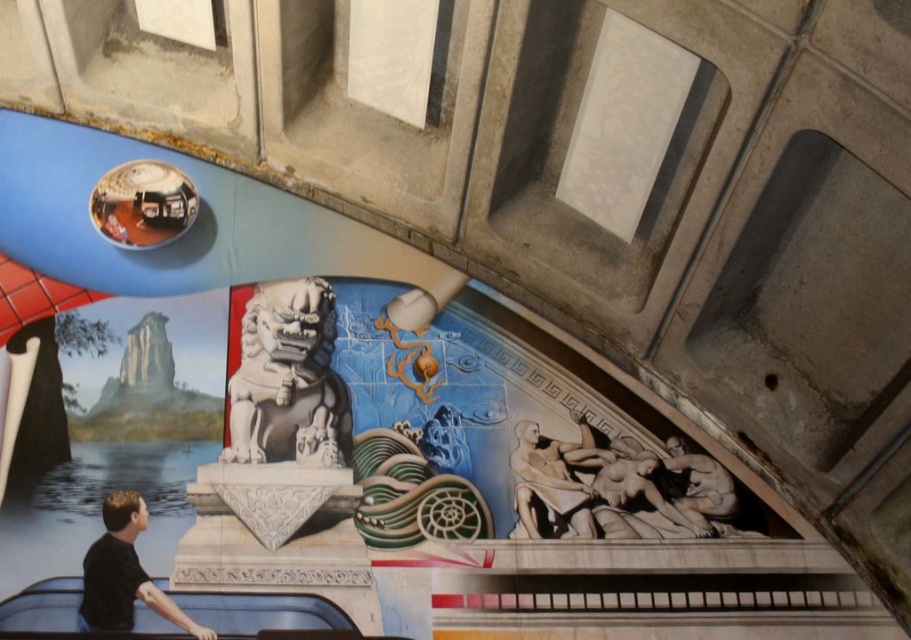
Based on the photo, you are an art student analyzing the mural. You notice two statues at the lower right corner of the mural. Which one is taller between the beige marble statue at lower right and the smooth stone statue at lower right?

The beige marble statue at lower right is much taller than the smooth stone statue at lower right.

From the picture: You are an art restorer working on the mural. You need to place a protective barrier around the beige marble statue at lower right and the smooth stone statue at lower right. Which statue requires a wider barrier to accommodate its size?

The beige marble statue at lower right might require a wider barrier since it might be wider than the smooth stone statue at lower right.

In the scene shown: You are an artist standing at the base of the bridge, looking up at the mural. You notice the white stone lion at center and the black matte shirt at lower left. Which object appears closer to you in the painting?

The white stone lion at center appears closer to you because the black matte shirt at lower left is behind it.